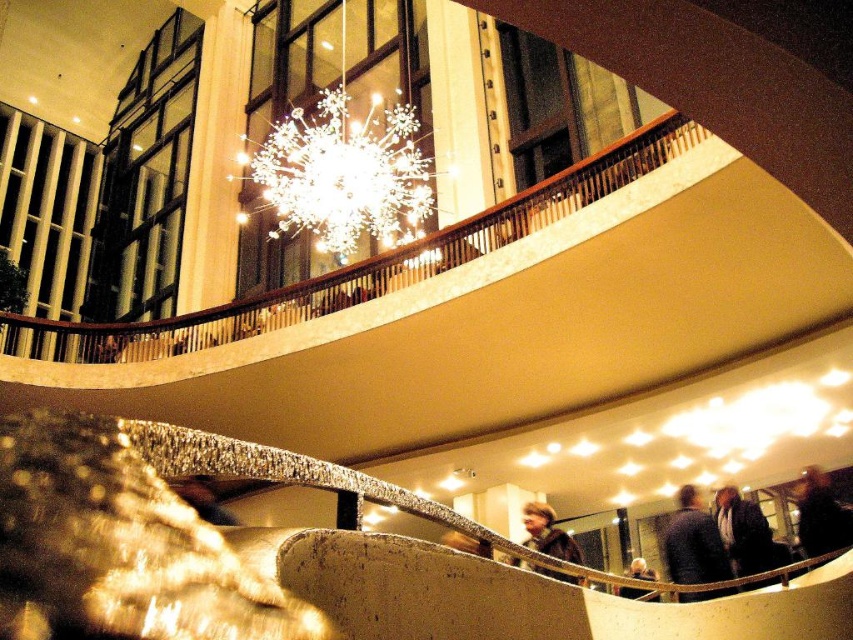
Question: Is dark brown leather jacket at center above light brown leather jacket at lower center?

Choices:
 (A) yes
 (B) no

Answer: (A)

Question: Which point is closer to the camera?

Choices:
 (A) (770, 554)
 (B) (637, 557)
 (C) (689, 579)
 (D) (849, 515)

Answer: (C)

Question: Which object is the closest to the light brown leather jacket at lower center?

Choices:
 (A) dark blue sweater at lower right
 (B) dark gray suit at lower right
 (C) dark brown leather jacket at center
 (D) dark brown leather jacket at lower right

Answer: (B)

Question: Which of the following is the closest to the observer?

Choices:
 (A) dark brown leather jacket at center
 (B) dark blue sweater at lower right

Answer: (A)

Question: Is dark blue sweater at lower right below dark gray suit at lower right?

Choices:
 (A) yes
 (B) no

Answer: (A)

Question: Is dark blue sweater at lower right smaller than dark gray suit at lower right?

Choices:
 (A) no
 (B) yes

Answer: (B)